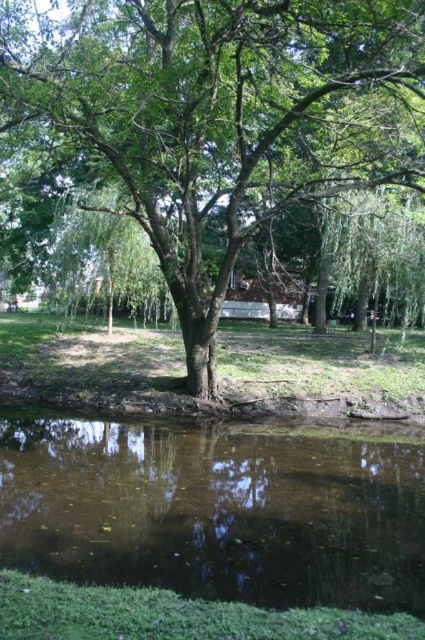
You are a landscape architect designing a new park. You want to place a 10 meter long wooden walkway between the green leafy tree at center and the brown murky water at bottom. Will the walkway fit between them?

The distance between the green leafy tree at center and the brown murky water at bottom is 9.09 meters. Since the walkway is 10 meters long, it will not fit between them as the distance is shorter than the walkway.

You are standing at the edge of the water in the park and want to take a photo of the green leafy tree at center. If your camera has a maximum zoom range of 10 meters, will you be able to capture the entire tree in the photo without moving closer?

The green leafy tree at center is 6.94 meters away from the camera. Since the camera can zoom up to 10 meters, you can capture the entire tree without moving closer.

You are standing at the origin point in the park. Where is the green leafy tree at center located in terms of coordinates?

The green leafy tree at center is located at coordinates point (224, 116).